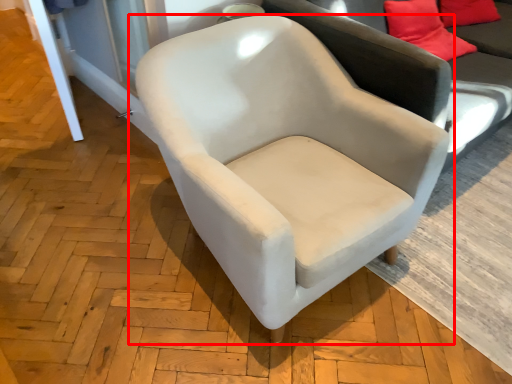
Question: From the image's perspective, what is the correct spatial positioning of chair (annotated by the red box) in reference to studio couch?

Choices:
 (A) below
 (B) above

Answer: (A)